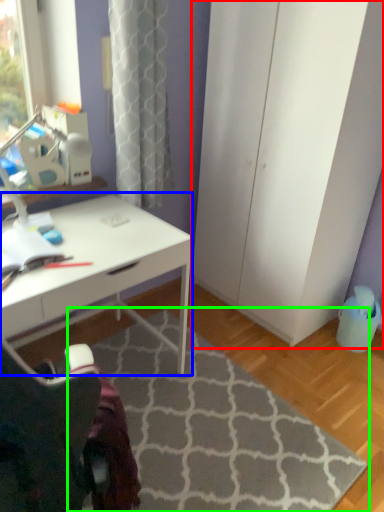
Question: Considering the real-world distances, which object is closest to screen door (highlighted by a red box)? desk (highlighted by a blue box) or doormat (highlighted by a green box).

Choices:
 (A) desk
 (B) doormat

Answer: (A)